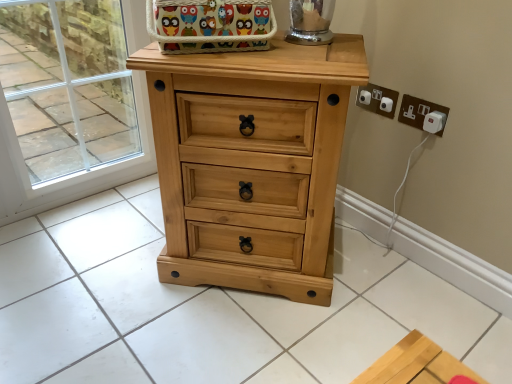
Identify the location of multicolored fabric basket at upper center. The width and height of the screenshot is (512, 384). (210, 25).

Describe the element at coordinates (69, 175) in the screenshot. The height and width of the screenshot is (384, 512). I see `transparent glass door at upper left` at that location.

This screenshot has width=512, height=384. Find the location of `light wood chest of drawers at center`. light wood chest of drawers at center is located at coordinates (251, 163).

From the image's perspective, is multicolored fabric basket at upper center below white plastic electrical outlet at upper right, placed as the second electric outlet when sorted from right to left?

Incorrect, from the image's perspective, multicolored fabric basket at upper center is higher than white plastic electrical outlet at upper right, placed as the second electric outlet when sorted from right to left.

Considering the positions of objects multicolored fabric basket at upper center and white plastic electrical outlet at upper right, which is the first electric outlet in left-to-right order, in the image provided, who is behind, multicolored fabric basket at upper center or white plastic electrical outlet at upper right, which is the first electric outlet in left-to-right order,?

white plastic electrical outlet at upper right, which is the first electric outlet in left-to-right order, is further from the camera.

Is multicolored fabric basket at upper center completely or partially outside of white plastic electrical outlet at upper right, placed as the second electric outlet when sorted from right to left?

That's correct, multicolored fabric basket at upper center is outside of white plastic electrical outlet at upper right, placed as the second electric outlet when sorted from right to left.

Does point (255, 28) lie in front of point (366, 106)?

Yes, point (255, 28) is in front of point (366, 106).

Considering the relative sizes of white plastic plug at upper right, which appears as the 1th electric outlet when viewed from the right, and multicolored fabric basket at upper center in the image provided, is white plastic plug at upper right, which appears as the 1th electric outlet when viewed from the right, smaller than multicolored fabric basket at upper center?

Yes, white plastic plug at upper right, which appears as the 1th electric outlet when viewed from the right, is smaller than multicolored fabric basket at upper center.

In the scene shown: From a real-world perspective, does white plastic plug at upper right, which appears as the 1th electric outlet when viewed from the right, stand above multicolored fabric basket at upper center?

Incorrect, from a real-world perspective, white plastic plug at upper right, which appears as the 1th electric outlet when viewed from the right, is lower than multicolored fabric basket at upper center.

Visually, is white plastic plug at upper right, positioned as the 2th electric outlet in left-to-right order, positioned to the left or to the right of multicolored fabric basket at upper center?

white plastic plug at upper right, positioned as the 2th electric outlet in left-to-right order, is positioned on multicolored fabric basket at upper center's right side.

From the image's perspective, is white plastic plug at upper right, which appears as the 1th electric outlet when viewed from the right, located beneath multicolored fabric basket at upper center?

Result: Indeed, from the image's perspective, white plastic plug at upper right, which appears as the 1th electric outlet when viewed from the right, is shown beneath multicolored fabric basket at upper center.

Looking at this image, from the image's perspective, is white plastic electrical outlet at upper right, placed as the second electric outlet when sorted from right to left, on top of transparent glass door at upper left?

No, from the image's perspective, white plastic electrical outlet at upper right, placed as the second electric outlet when sorted from right to left, is not over transparent glass door at upper left.

Locate an element on the screen. Image resolution: width=512 pixels, height=384 pixels. the 1st electric outlet below the transparent glass door at upper left (from the image's perspective) is located at coordinates (377, 99).

Considering the relative sizes of white plastic electrical outlet at upper right, which is the first electric outlet in left-to-right order, and transparent glass door at upper left in the image provided, is white plastic electrical outlet at upper right, which is the first electric outlet in left-to-right order, taller than transparent glass door at upper left?

No, white plastic electrical outlet at upper right, which is the first electric outlet in left-to-right order, is not taller than transparent glass door at upper left.

Considering the points (388, 98) and (5, 171), which point is in front, point (388, 98) or point (5, 171)?

The point (388, 98) is in front.

Is multicolored fabric basket at upper center turned away from white plastic plug at upper right, which appears as the 1th electric outlet when viewed from the right?

No, multicolored fabric basket at upper center is not facing the opposite direction of white plastic plug at upper right, which appears as the 1th electric outlet when viewed from the right.

In terms of height, does multicolored fabric basket at upper center look taller or shorter compared to white plastic plug at upper right, which appears as the 1th electric outlet when viewed from the right?

multicolored fabric basket at upper center is taller than white plastic plug at upper right, which appears as the 1th electric outlet when viewed from the right.

Is multicolored fabric basket at upper center bigger than white plastic plug at upper right, positioned as the 2th electric outlet in left-to-right order?

Yes, multicolored fabric basket at upper center is bigger than white plastic plug at upper right, positioned as the 2th electric outlet in left-to-right order.

Is there a large distance between multicolored fabric basket at upper center and white plastic plug at upper right, which appears as the 1th electric outlet when viewed from the right?

multicolored fabric basket at upper center is actually quite close to white plastic plug at upper right, which appears as the 1th electric outlet when viewed from the right.

Is transparent glass door at upper left with white plastic plug at upper right, which appears as the 1th electric outlet when viewed from the right?

transparent glass door at upper left and white plastic plug at upper right, which appears as the 1th electric outlet when viewed from the right, are not in contact.

Which of these two, transparent glass door at upper left or white plastic plug at upper right, which appears as the 1th electric outlet when viewed from the right, is wider?

With larger width is transparent glass door at upper left.

Is transparent glass door at upper left smaller than white plastic plug at upper right, positioned as the 2th electric outlet in left-to-right order?

No, transparent glass door at upper left is not smaller than white plastic plug at upper right, positioned as the 2th electric outlet in left-to-right order.

Is point (293, 271) behind point (386, 105)?

No, it is not.

Could you measure the distance between light wood chest of drawers at center and white plastic electrical outlet at upper right, which is the first electric outlet in left-to-right order?

The distance of light wood chest of drawers at center from white plastic electrical outlet at upper right, which is the first electric outlet in left-to-right order, is 20.86 inches.

Is light wood chest of drawers at center spatially inside white plastic electrical outlet at upper right, placed as the second electric outlet when sorted from right to left, or outside of it?

light wood chest of drawers at center is not inside white plastic electrical outlet at upper right, placed as the second electric outlet when sorted from right to left, it's outside.

Considering the sizes of objects light wood chest of drawers at center and white plastic electrical outlet at upper right, placed as the second electric outlet when sorted from right to left, in the image provided, who is bigger, light wood chest of drawers at center or white plastic electrical outlet at upper right, placed as the second electric outlet when sorted from right to left,?

light wood chest of drawers at center is bigger.

In the image, is white plastic electrical outlet at upper right, placed as the second electric outlet when sorted from right to left, on the left side or the right side of multicolored fabric basket at upper center?

From the image, it's evident that white plastic electrical outlet at upper right, placed as the second electric outlet when sorted from right to left, is to the right of multicolored fabric basket at upper center.

Between point (372, 90) and point (191, 6), which one is positioned behind?

Positioned behind is point (372, 90).

Is multicolored fabric basket at upper center at the back of white plastic electrical outlet at upper right, placed as the second electric outlet when sorted from right to left?

That's not correct — white plastic electrical outlet at upper right, placed as the second electric outlet when sorted from right to left, is not looking away from multicolored fabric basket at upper center.

Image resolution: width=512 pixels, height=384 pixels. Identify the location of basket that appears above the white plastic electrical outlet at upper right, placed as the second electric outlet when sorted from right to left (from a real-world perspective). (210, 25).

Starting from the multicolored fabric basket at upper center, which electric outlet is the 1st one behind? Please provide its 2D coordinates.

[(417, 110)]

Based on their spatial positions, is white plastic electrical outlet at upper right, placed as the second electric outlet when sorted from right to left, or transparent glass door at upper left further from light wood chest of drawers at center?

Answer: Based on the image, transparent glass door at upper left appears to be further to light wood chest of drawers at center.

Looking at this image, looking at the image, which one is located closer to light wood chest of drawers at center, white plastic plug at upper right, positioned as the 2th electric outlet in left-to-right order, or multicolored fabric basket at upper center?

The object closer to light wood chest of drawers at center is multicolored fabric basket at upper center.

Considering their positions, is transparent glass door at upper left positioned closer to white plastic plug at upper right, positioned as the 2th electric outlet in left-to-right order, than light wood chest of drawers at center?

Based on the image, light wood chest of drawers at center appears to be nearer to white plastic plug at upper right, positioned as the 2th electric outlet in left-to-right order.

Considering their positions, is white plastic electrical outlet at upper right, which is the first electric outlet in left-to-right order, positioned further to transparent glass door at upper left than multicolored fabric basket at upper center?

Among the two, white plastic electrical outlet at upper right, which is the first electric outlet in left-to-right order, is located further to transparent glass door at upper left.

From the image, which object appears to be nearer to white plastic electrical outlet at upper right, which is the first electric outlet in left-to-right order, multicolored fabric basket at upper center or transparent glass door at upper left?

multicolored fabric basket at upper center.

Considering their positions, is white plastic electrical outlet at upper right, which is the first electric outlet in left-to-right order, positioned further to multicolored fabric basket at upper center than transparent glass door at upper left?

transparent glass door at upper left lies further to multicolored fabric basket at upper center than the other object.

Based on their spatial positions, is multicolored fabric basket at upper center or transparent glass door at upper left closer to light wood chest of drawers at center?

multicolored fabric basket at upper center is positioned closer to the anchor light wood chest of drawers at center.

Considering their positions, is transparent glass door at upper left positioned further to white plastic plug at upper right, which appears as the 1th electric outlet when viewed from the right, than multicolored fabric basket at upper center?

transparent glass door at upper left.

I want to click on the chest of drawers situated between transparent glass door at upper left and white plastic electrical outlet at upper right, placed as the second electric outlet when sorted from right to left, from left to right, so click(251, 163).

Locate an element on the screen. basket between transparent glass door at upper left and white plastic plug at upper right, which appears as the 1th electric outlet when viewed from the right, in the horizontal direction is located at coordinates (210, 25).

The image size is (512, 384). I want to click on chest of drawers between multicolored fabric basket at upper center and white plastic electrical outlet at upper right, placed as the second electric outlet when sorted from right to left, so click(x=251, y=163).

Find the location of a particular element. The width and height of the screenshot is (512, 384). chest of drawers between multicolored fabric basket at upper center and white plastic plug at upper right, positioned as the 2th electric outlet in left-to-right order, from left to right is located at coordinates (251, 163).